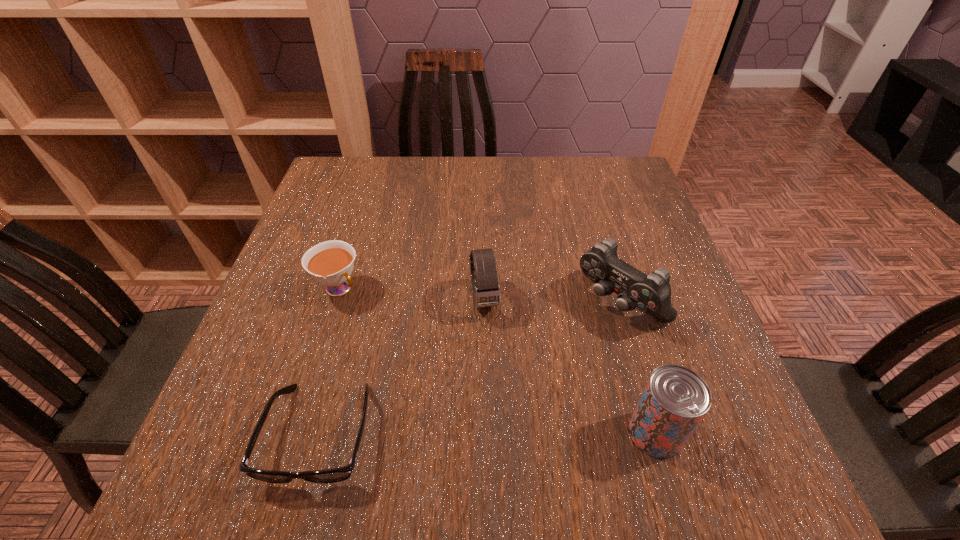
Locate an element on the screen. control at the right edge is located at coordinates (651, 294).

At what (x,y) coordinates should I click in order to perform the action: click on object that is positioned at the near left corner. Please return your answer as a coordinate pair (x, y). The height and width of the screenshot is (540, 960). Looking at the image, I should click on (340, 474).

You are a GUI agent. You are given a task and a screenshot of the screen. Output one action in this format:
    pyautogui.click(x=<x>, y=<y>)
    Task: Click on the object that is at the near right corner
    The image size is (960, 540).
    Given the screenshot: What is the action you would take?
    pyautogui.click(x=675, y=399)

Locate an element on the screen. vacant position at the far edge of the desktop is located at coordinates [x=502, y=175].

In the image, there is a desktop. Where is `vacant space at the near edge`? The image size is (960, 540). vacant space at the near edge is located at coordinates click(x=579, y=402).

In the image, there is a desktop. Where is `blank space at the left edge`? The image size is (960, 540). blank space at the left edge is located at coordinates (266, 330).

The height and width of the screenshot is (540, 960). Identify the location of free space at the right edge. (607, 206).

In the image, there is a desktop. At what (x,y) coordinates should I click in order to perform the action: click on vacant space at the far left corner. Please return your answer as a coordinate pair (x, y). Looking at the image, I should click on (353, 183).

Where is `vacant region at the far right corner of the desktop`? vacant region at the far right corner of the desktop is located at coordinates (593, 180).

The image size is (960, 540). In order to click on vacant point located between the teacup and the spectacles in this screenshot , I will do `click(329, 361)`.